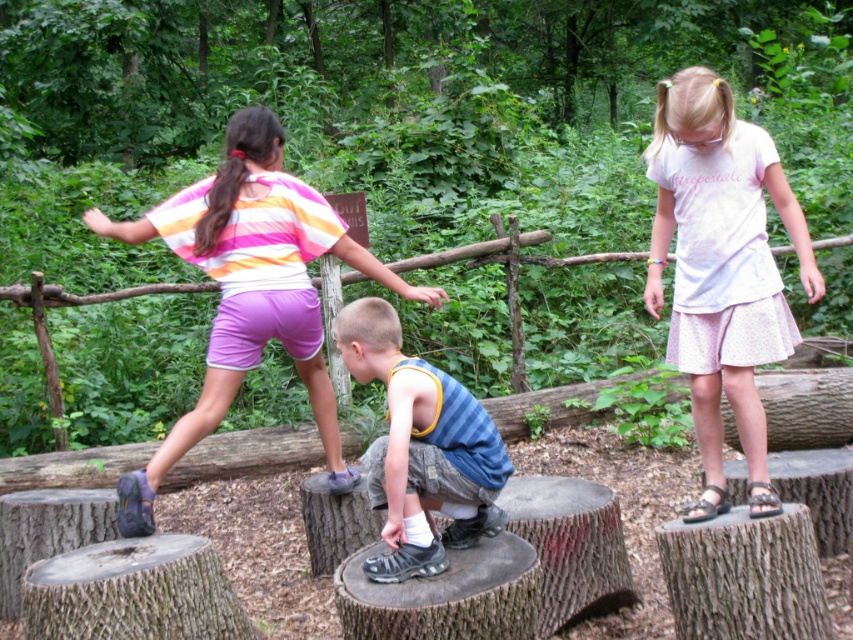
Question: Which point is closer to the camera?

Choices:
 (A) (376, 474)
 (B) (769, 310)

Answer: (A)

Question: Considering the relative positions of matte pink shorts at left and blue striped tank top at center in the image provided, where is matte pink shorts at left located with respect to blue striped tank top at center?

Choices:
 (A) below
 (B) above

Answer: (B)

Question: Does pale pink fabric skirt at center appear on the right side of blue striped tank top at center?

Choices:
 (A) no
 (B) yes

Answer: (B)

Question: Which point is closer to the camera?

Choices:
 (A) blue striped tank top at center
 (B) matte pink shorts at left

Answer: (A)

Question: Considering the relative positions of pale pink fabric skirt at center and blue striped tank top at center in the image provided, where is pale pink fabric skirt at center located with respect to blue striped tank top at center?

Choices:
 (A) left
 (B) right

Answer: (B)

Question: Among these points, which one is nearest to the camera?

Choices:
 (A) (241, 216)
 (B) (718, 234)

Answer: (B)